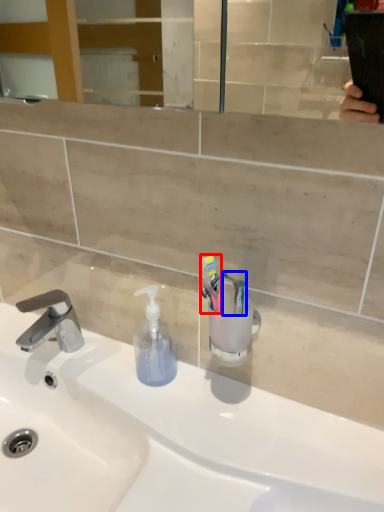
Question: Which object appears farthest to the camera in this image, toothbrush (highlighted by a red box) or toothbrush (highlighted by a blue box)?

Choices:
 (A) toothbrush
 (B) toothbrush

Answer: (B)